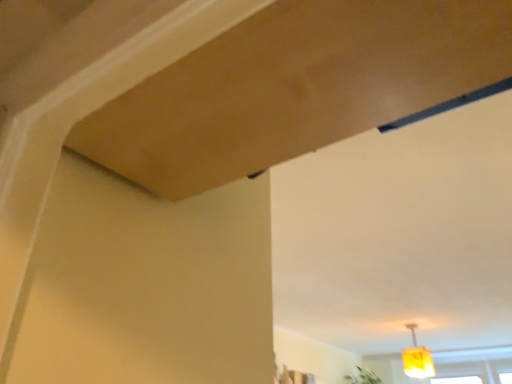
This screenshot has height=384, width=512. What do you see at coordinates (417, 358) in the screenshot? I see `yellow fabric lampshade at lower right` at bounding box center [417, 358].

Locate an element on the screen. This screenshot has width=512, height=384. yellow fabric lampshade at lower right is located at coordinates (417, 358).

What is the approximate height of yellow fabric lampshade at lower right?

It is 14.72 inches.

Locate an element on the screen. yellow fabric lampshade at lower right is located at coordinates (417, 358).